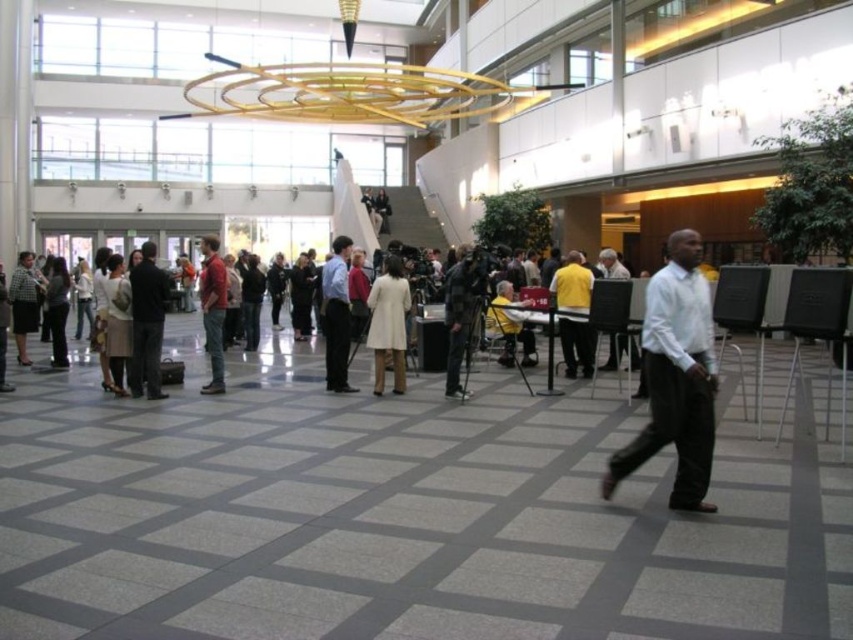
Based on the photo, you are organizing a photoshoot in the lobby and need to place both the matte black camera at center and the red cotton shirt at center on a table. Since the table has limited space, which object should you place first to ensure both fit comfortably?

The matte black camera at center occupies less space than the red cotton shirt at center, so you should place the red cotton shirt at center first to ensure there is enough space left for the matte black camera at center.

You are standing in the lobby and see a light beige coat at center and a yellow shirt at center. Which one is positioned to the left?

The light beige coat at center is to the left of the yellow shirt at center.